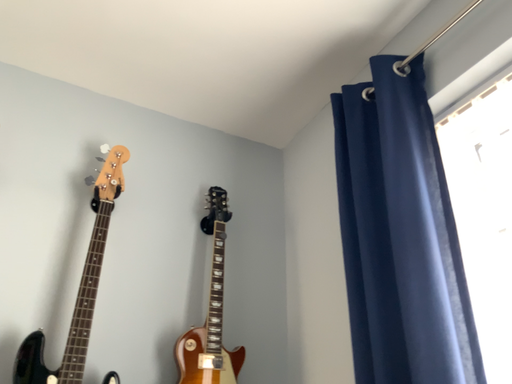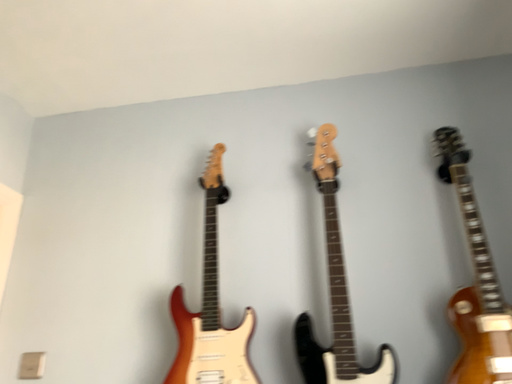
Question: How did the camera likely rotate when shooting the video?

Choices:
 (A) rotated right
 (B) rotated left

Answer: (B)